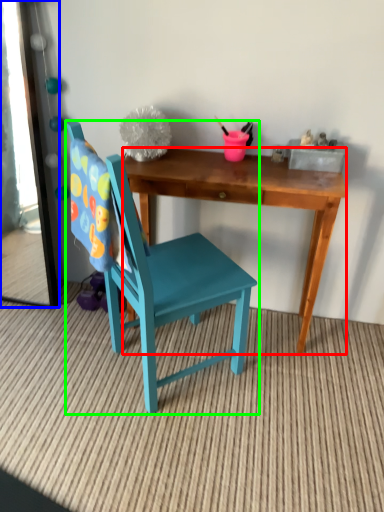
Question: Considering the real-world distances, which object is farthest from desk (highlighted by a red box)? mirror (highlighted by a blue box) or chair (highlighted by a green box)?

Choices:
 (A) mirror
 (B) chair

Answer: (A)